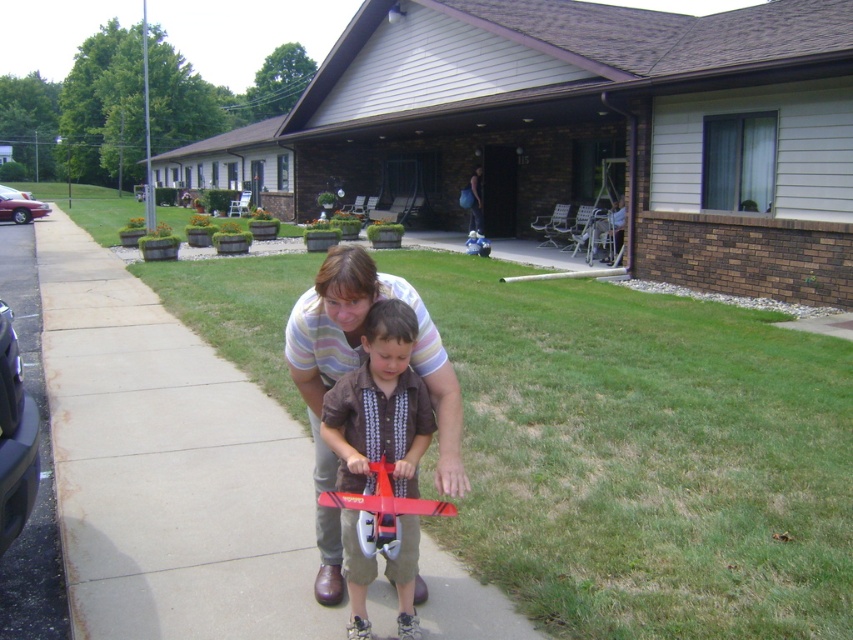
In the scene shown: Is matte brown shirt at center positioned in front of shiny red airplane at center?

No, matte brown shirt at center is behind shiny red airplane at center.

Which is above, matte brown shirt at center or shiny red airplane at center?

matte brown shirt at center is above.

Is point (396, 563) positioned before point (361, 518)?

No, it is not.

You are a GUI agent. You are given a task and a screenshot of the screen. Output one action in this format:
    pyautogui.click(x=<x>, y=<y>)
    Task: Click on the matte brown shirt at center
    
    Given the screenshot: What is the action you would take?
    pyautogui.click(x=380, y=404)

Which is behind, point (231, 518) or point (4, 205)?

The point (4, 205) is behind.

Is point (84, 376) less distant than point (9, 209)?

Yes, point (84, 376) is in front of point (9, 209).

Where is `smooth concrete sidewalk at center`? The image size is (853, 640). smooth concrete sidewalk at center is located at coordinates (167, 467).

Is smooth concrete sidewalk at center smaller than shiny red airplane at center?

Incorrect, smooth concrete sidewalk at center is not smaller in size than shiny red airplane at center.

Measure the distance between smooth concrete sidewalk at center and shiny red airplane at center.

smooth concrete sidewalk at center is 1.96 meters from shiny red airplane at center.

At what (x,y) coordinates should I click in order to perform the action: click on smooth concrete sidewalk at center. Please return your answer as a coordinate pair (x, y). Looking at the image, I should click on (167, 467).